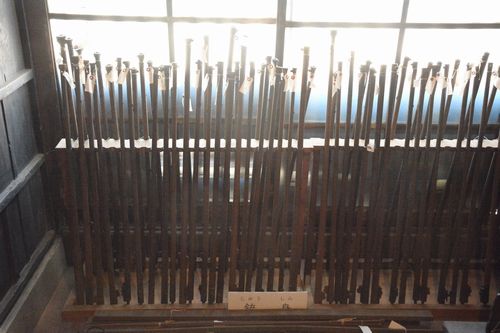
You are a GUI agent. You are given a task and a screenshot of the screen. Output one action in this format:
    pyautogui.click(x=<x>, y=<y>)
    Task: Click on the window
    The image size is (500, 333).
    Given the screenshot: What is the action you would take?
    pyautogui.click(x=230, y=8), pyautogui.click(x=321, y=4)